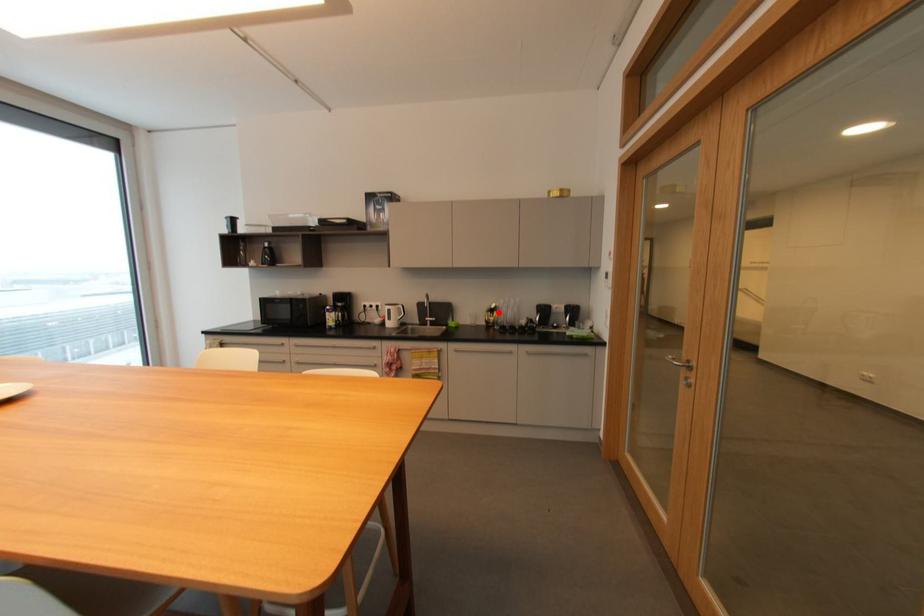
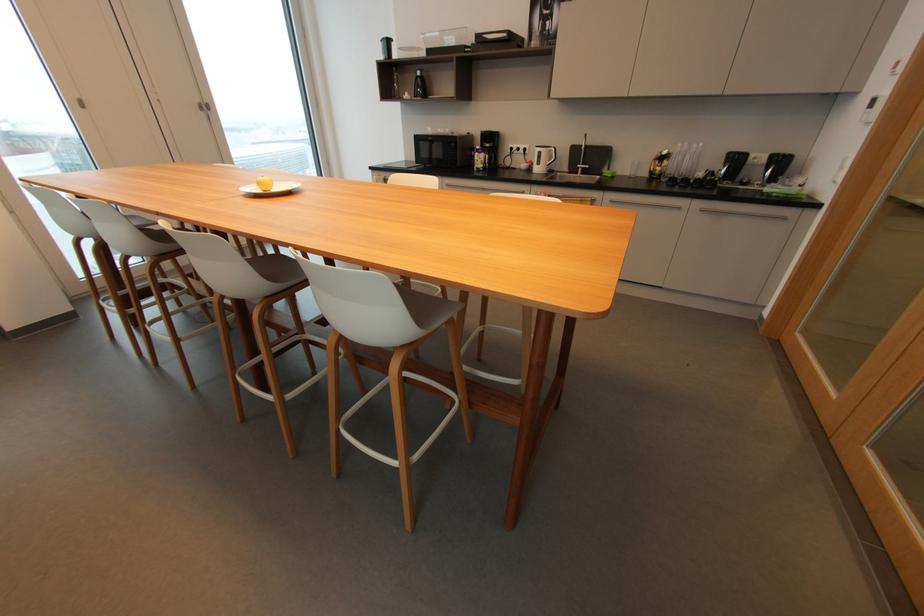
Where in the second image is the point corresponding to the highlighted location from the first image?

(669, 161)